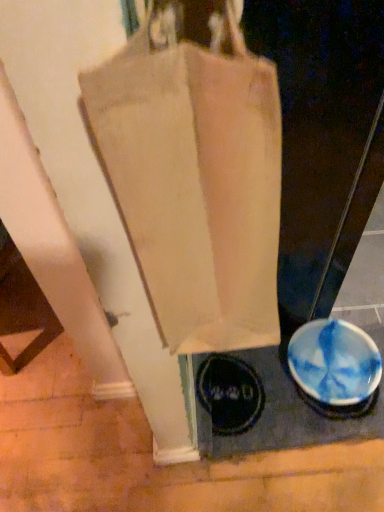
Question: Is blue glossy bowl at lower right at the right side of canvas bag at center?

Choices:
 (A) no
 (B) yes

Answer: (B)

Question: Does blue glossy bowl at lower right come behind canvas bag at center?

Choices:
 (A) yes
 (B) no

Answer: (A)

Question: Can you confirm if blue glossy bowl at lower right is shorter than canvas bag at center?

Choices:
 (A) yes
 (B) no

Answer: (A)

Question: Considering the relative sizes of blue glossy bowl at lower right and canvas bag at center in the image provided, is blue glossy bowl at lower right bigger than canvas bag at center?

Choices:
 (A) no
 (B) yes

Answer: (A)

Question: From the image's perspective, is blue glossy bowl at lower right located above canvas bag at center?

Choices:
 (A) yes
 (B) no

Answer: (B)

Question: Can you confirm if blue glossy bowl at lower right is wider than canvas bag at center?

Choices:
 (A) yes
 (B) no

Answer: (A)

Question: Is canvas bag at center wider than blue glossy bowl at lower right?

Choices:
 (A) no
 (B) yes

Answer: (A)

Question: Considering the relative positions of canvas bag at center and blue glossy bowl at lower right in the image provided, is canvas bag at center to the right of blue glossy bowl at lower right from the viewer's perspective?

Choices:
 (A) yes
 (B) no

Answer: (B)

Question: Can we say canvas bag at center lies outside blue glossy bowl at lower right?

Choices:
 (A) yes
 (B) no

Answer: (A)

Question: Considering the relative sizes of canvas bag at center and blue glossy bowl at lower right in the image provided, is canvas bag at center smaller than blue glossy bowl at lower right?

Choices:
 (A) no
 (B) yes

Answer: (A)

Question: From the image's perspective, is canvas bag at center over blue glossy bowl at lower right?

Choices:
 (A) no
 (B) yes

Answer: (B)

Question: Considering the relative positions of canvas bag at center and blue glossy bowl at lower right in the image provided, is canvas bag at center to the left of blue glossy bowl at lower right from the viewer's perspective?

Choices:
 (A) yes
 (B) no

Answer: (A)

Question: Considering their positions, is canvas bag at center located in front of or behind blue glossy bowl at lower right?

Choices:
 (A) behind
 (B) front

Answer: (B)